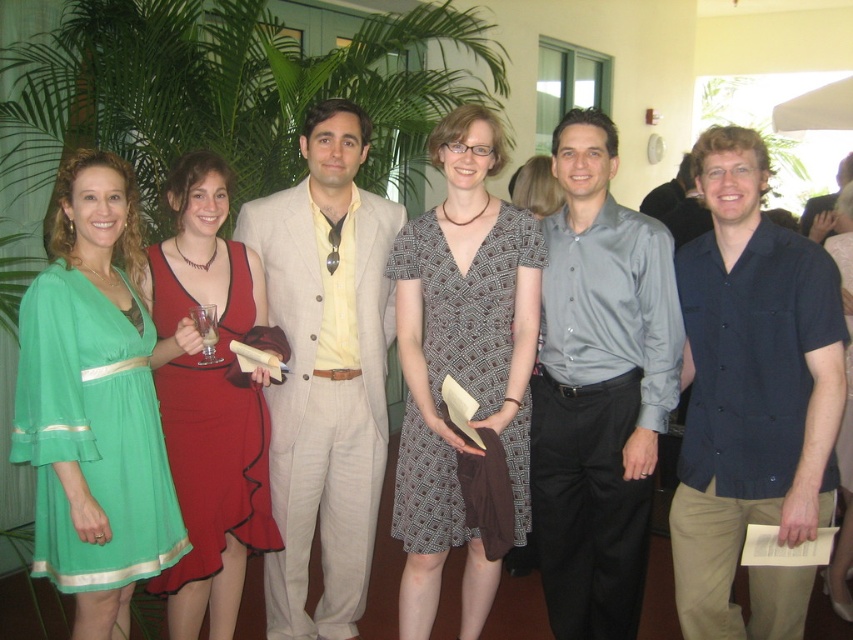
Can you confirm if dark blue button-up shirt at center is bigger than green chiffon dress at left?

Indeed, dark blue button-up shirt at center has a larger size compared to green chiffon dress at left.

Which is above, dark blue button-up shirt at center or green chiffon dress at left?

dark blue button-up shirt at center is above.

This screenshot has height=640, width=853. What do you see at coordinates (752, 397) in the screenshot? I see `dark blue button-up shirt at center` at bounding box center [752, 397].

Find the location of a particular element. dark blue button-up shirt at center is located at coordinates (752, 397).

From the picture: How distant is dark blue button-up shirt at center from light beige suit at center?

They are 3.39 feet apart.

This screenshot has height=640, width=853. Identify the location of dark blue button-up shirt at center. (752, 397).

Locate an element on the screen. This screenshot has width=853, height=640. dark blue button-up shirt at center is located at coordinates (752, 397).

Between matte red dress at center and matte black dress at center, which one is positioned lower?

matte red dress at center is lower down.

Where is `matte red dress at center`? This screenshot has height=640, width=853. matte red dress at center is located at coordinates (219, 440).